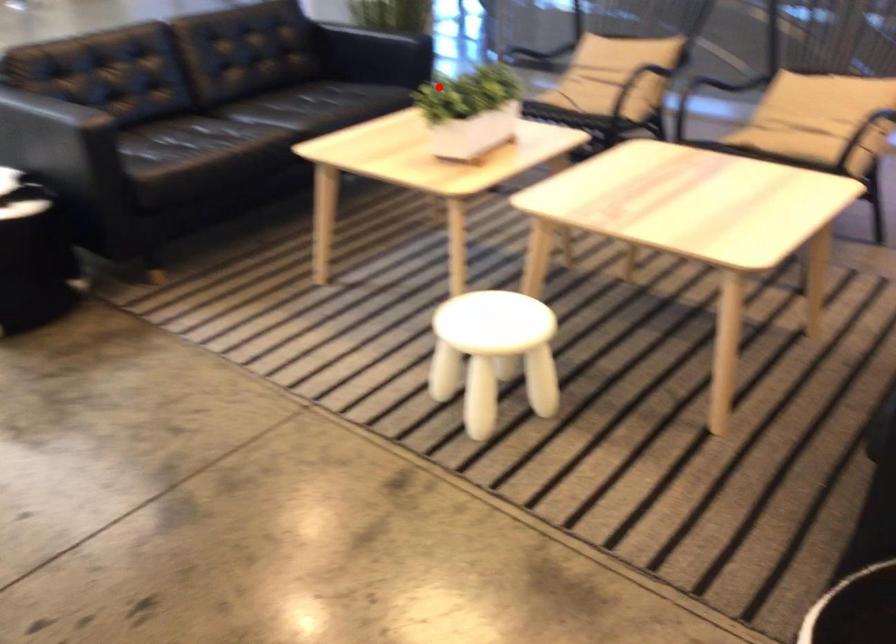
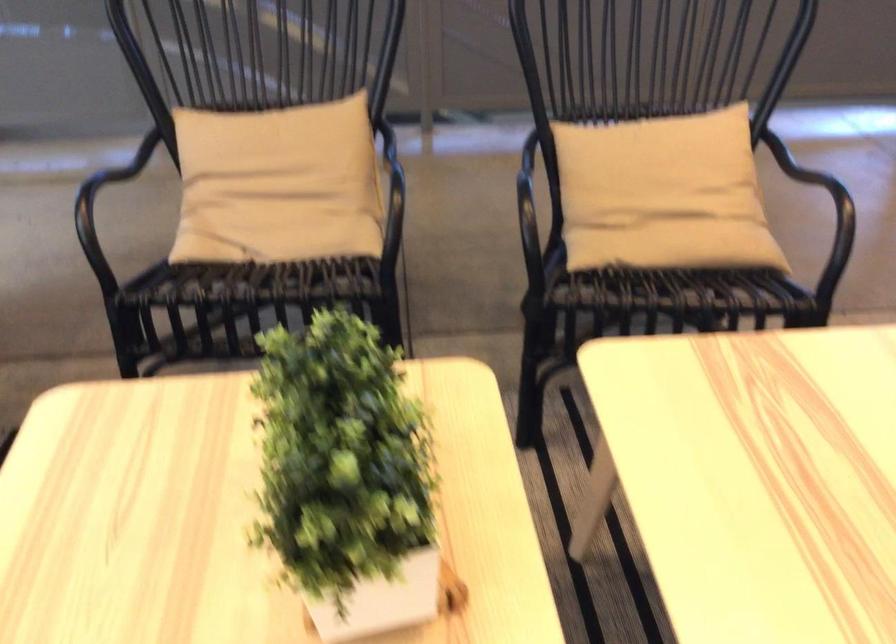
Question: I am providing you with two images of the same scene from different viewpoints. Given a red point in image1, look at the same physical point in image2. Is it:

Choices:
 (A) Closer to the viewpoint
 (B) Farther from the viewpoint

Answer: (A)